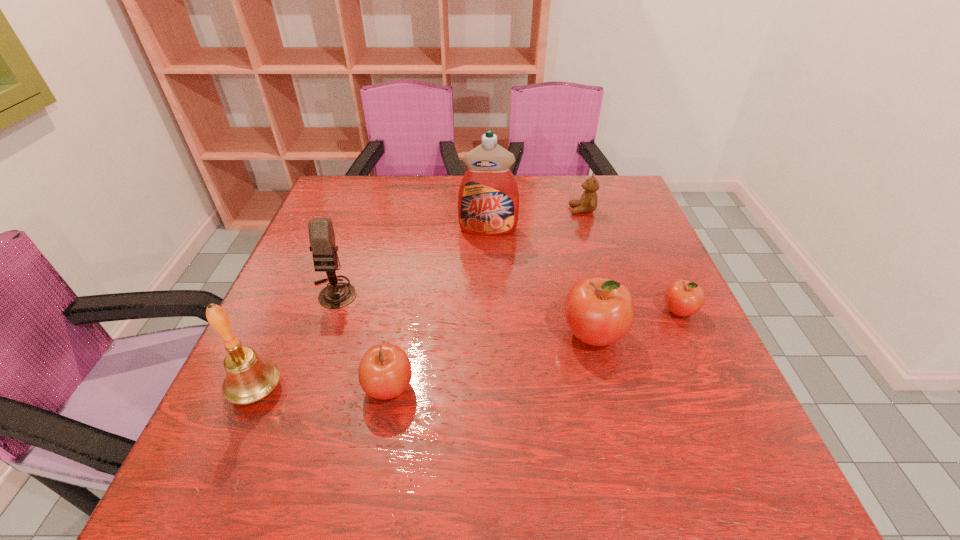
Locate an element on the screen. Image resolution: width=960 pixels, height=540 pixels. vacant space at the right edge of the desktop is located at coordinates (595, 221).

The image size is (960, 540). What are the coordinates of `vacant region at the far left corner of the desktop` in the screenshot? It's located at (364, 194).

You are a GUI agent. You are given a task and a screenshot of the screen. Output one action in this format:
    pyautogui.click(x=<x>, y=<y>)
    Task: Click on the vacant space at the near right corner of the desktop
    The image size is (960, 540).
    Given the screenshot: What is the action you would take?
    (716, 414)

Find the location of `free spot between the rightmost apple and the bell`. free spot between the rightmost apple and the bell is located at coordinates (468, 350).

Where is `vacant area that lies between the tallest apple and the fourth object from right to left`? vacant area that lies between the tallest apple and the fourth object from right to left is located at coordinates (540, 281).

Where is `free spot between the tallest apple and the farthest object`? The width and height of the screenshot is (960, 540). free spot between the tallest apple and the farthest object is located at coordinates (588, 272).

Locate an element on the screen. This screenshot has height=540, width=960. free space between the tallest apple and the teddy bear is located at coordinates (588, 272).

You are a GUI agent. You are given a task and a screenshot of the screen. Output one action in this format:
    pyautogui.click(x=<x>, y=<y>)
    Task: Click on the free spot between the shortest apple and the leftmost apple
    The image size is (960, 540).
    Given the screenshot: What is the action you would take?
    pyautogui.click(x=534, y=349)

Locate an element on the screen. The width and height of the screenshot is (960, 540). vacant space that is in between the rightmost apple and the tallest apple is located at coordinates (636, 322).

This screenshot has height=540, width=960. Identify the location of vacant point located between the tallest object and the bell. (372, 309).